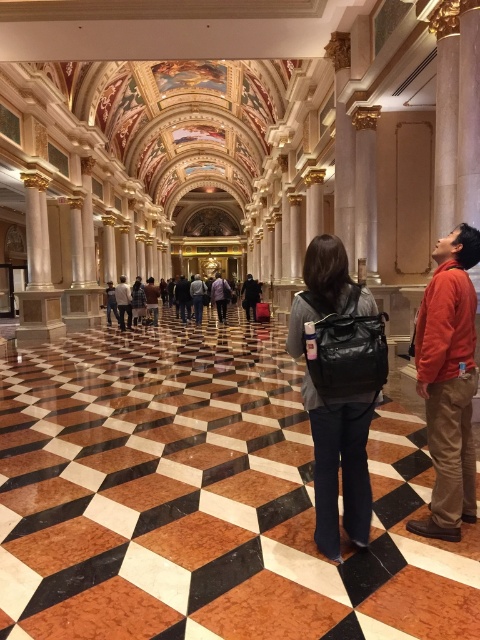
Is orange cotton jacket at right below black leather coat at center?

Yes.

Image resolution: width=480 pixels, height=640 pixels. What are the coordinates of `orange cotton jacket at right` in the screenshot? It's located at (448, 381).

Does point (453, 273) come in front of point (247, 284)?

Yes.

Identify the location of orange cotton jacket at right. pos(448,381).

Between purple fabric jacket at center and brown leather backpack at center, which one appears on the left side from the viewer's perspective?

From the viewer's perspective, brown leather backpack at center appears more on the left side.

Does purple fabric jacket at center appear over brown leather backpack at center?

Yes, purple fabric jacket at center is above brown leather backpack at center.

This screenshot has width=480, height=640. Describe the element at coordinates (220, 296) in the screenshot. I see `purple fabric jacket at center` at that location.

Where is `purple fabric jacket at center`? purple fabric jacket at center is located at coordinates (220, 296).

Does orange cotton jacket at right have a greater height compared to dark gray backpack at center?

Indeed, orange cotton jacket at right has a greater height compared to dark gray backpack at center.

Between orange cotton jacket at right and dark gray backpack at center, which one has less height?

dark gray backpack at center is shorter.

What do you see at coordinates (448, 381) in the screenshot?
I see `orange cotton jacket at right` at bounding box center [448, 381].

The height and width of the screenshot is (640, 480). I want to click on orange cotton jacket at right, so click(448, 381).